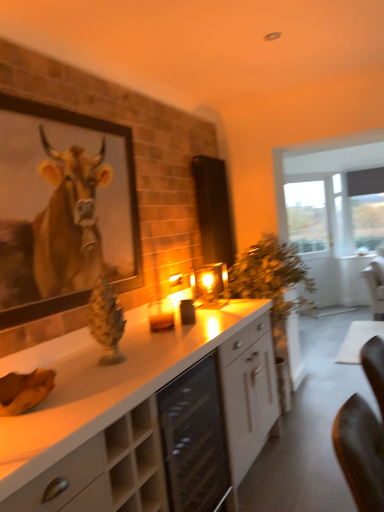
The width and height of the screenshot is (384, 512). What are the coordinates of `free point above beige wood cabinet at lower left, the second cabinetry positioned from the back (from a real-world perspective)` in the screenshot? It's located at (49, 402).